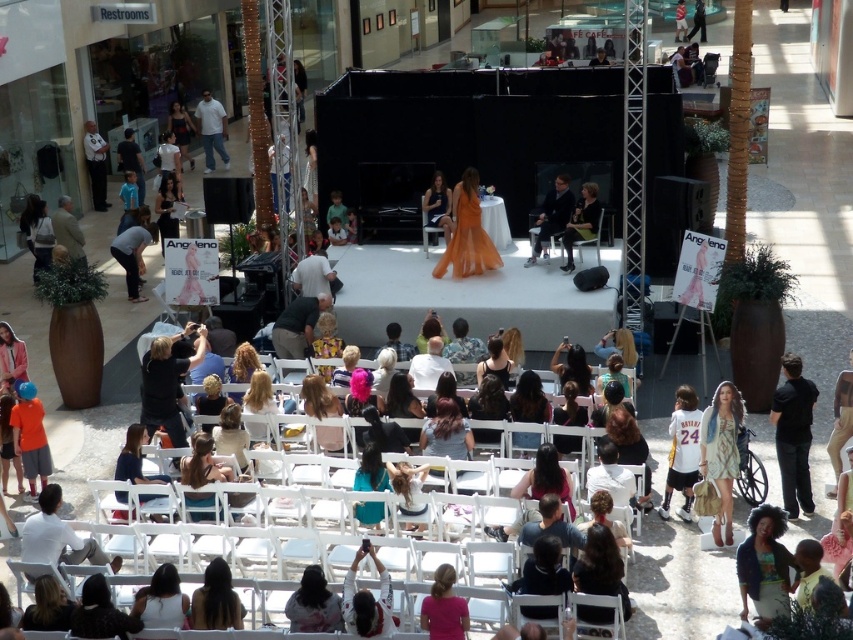
At what (x,y) coordinates should I click in order to perform the action: click on white jersey at center. Please return your answer as a coordinate pair (x, y). This screenshot has height=640, width=853. Looking at the image, I should click on (682, 451).

Measure the distance between point (679,509) and camera.

They are 45.70 feet apart.

Locate an element on the screen. The image size is (853, 640). white jersey at center is located at coordinates (682, 451).

Can you confirm if black cotton shirt at lower right is positioned to the right of orange cotton shirt at lower left?

Indeed, black cotton shirt at lower right is positioned on the right side of orange cotton shirt at lower left.

Which is behind, point (788, 506) or point (32, 417)?

Positioned behind is point (32, 417).

Does point (788, 500) come closer to viewer compared to point (27, 454)?

Yes, it is in front of point (27, 454).

Find the location of a particular element. This screenshot has width=853, height=640. black cotton shirt at lower right is located at coordinates (793, 435).

Who is lower down, orange chiffon dress at center or black leather jacket at center?

Positioned lower is orange chiffon dress at center.

Image resolution: width=853 pixels, height=640 pixels. Describe the element at coordinates (467, 237) in the screenshot. I see `orange chiffon dress at center` at that location.

Identify the location of orange chiffon dress at center. (467, 237).